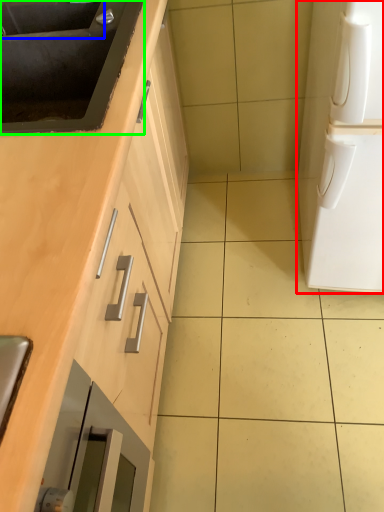
Question: Which object is the closest to the home appliance (highlighted by a red box)? Choose among these: sink (highlighted by a blue box) or sink (highlighted by a green box).

Choices:
 (A) sink
 (B) sink

Answer: (B)